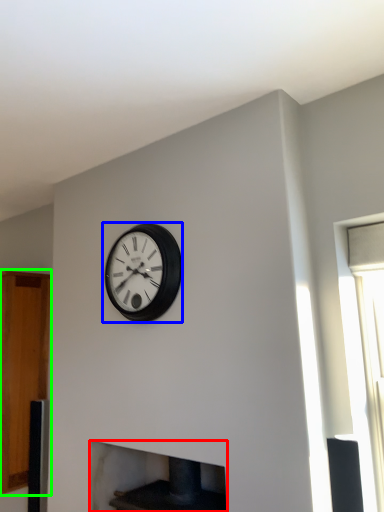
Question: Based on their relative distances, which object is farther from fireplace (highlighted by a red box)? Choose from wall clock (highlighted by a blue box) and cabinetry (highlighted by a green box).

Choices:
 (A) wall clock
 (B) cabinetry

Answer: (A)